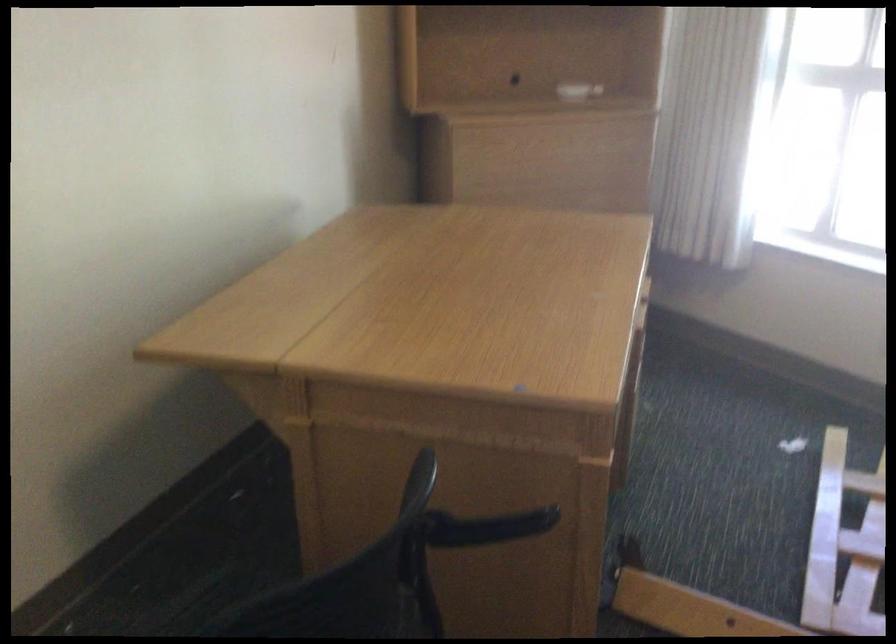
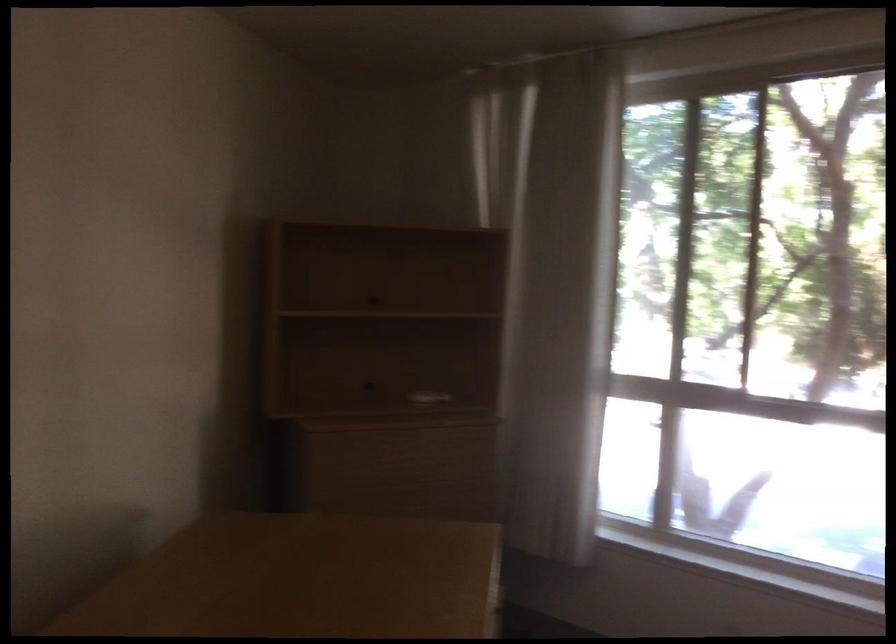
Question: Which direction would the cameraman need to move to produce the second image? Reply with the corresponding letter.

Choices:
 (A) Left
 (B) Right
 (C) Forward
 (D) Backward

Answer: (D)